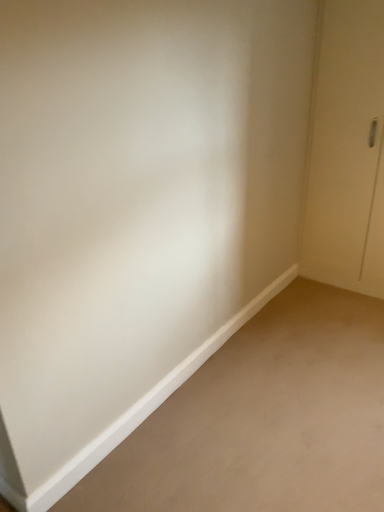
Question: Should I look upward or downward to see white matte baseboard at lower left?

Choices:
 (A) up
 (B) down

Answer: (B)

Question: Does white matte baseboard at lower left have a lesser height compared to white matte door at right?

Choices:
 (A) no
 (B) yes

Answer: (B)

Question: Are white matte baseboard at lower left and white matte door at right making contact?

Choices:
 (A) yes
 (B) no

Answer: (B)

Question: From a real-world perspective, is white matte baseboard at lower left positioned under white matte door at right based on gravity?

Choices:
 (A) yes
 (B) no

Answer: (A)

Question: Considering the relative sizes of white matte baseboard at lower left and white matte door at right in the image provided, is white matte baseboard at lower left bigger than white matte door at right?

Choices:
 (A) no
 (B) yes

Answer: (A)

Question: From the image's perspective, would you say white matte baseboard at lower left is shown under white matte door at right?

Choices:
 (A) yes
 (B) no

Answer: (A)

Question: Does white matte baseboard at lower left have a greater height compared to white matte door at right?

Choices:
 (A) no
 (B) yes

Answer: (A)

Question: Can you confirm if white matte door at right is positioned to the left of white matte baseboard at lower left?

Choices:
 (A) no
 (B) yes

Answer: (A)

Question: From the image's perspective, is white matte door at right on top of white matte baseboard at lower left?

Choices:
 (A) no
 (B) yes

Answer: (B)

Question: Is white matte door at right surrounding white matte baseboard at lower left?

Choices:
 (A) no
 (B) yes

Answer: (A)

Question: From a real-world perspective, is white matte door at right located higher than white matte baseboard at lower left?

Choices:
 (A) yes
 (B) no

Answer: (A)

Question: From the image's perspective, is white matte door at right beneath white matte baseboard at lower left?

Choices:
 (A) yes
 (B) no

Answer: (B)

Question: Can you confirm if white matte door at right is bigger than white matte baseboard at lower left?

Choices:
 (A) no
 (B) yes

Answer: (B)

Question: In the image, is white matte door at right on the left side or the right side of white matte baseboard at lower left?

Choices:
 (A) left
 (B) right

Answer: (B)